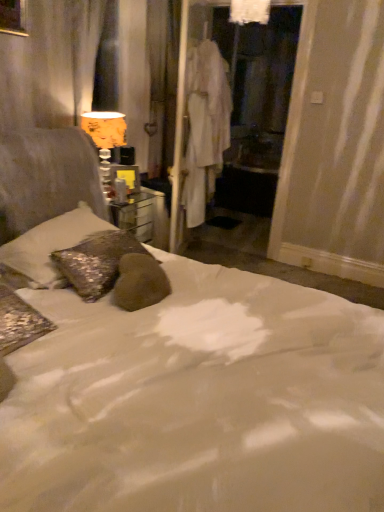
Question: Is orange fabric lampshade at upper left located within white fabric robe at center?

Choices:
 (A) no
 (B) yes

Answer: (A)

Question: From a real-world perspective, is white fabric robe at center located beneath orange fabric lampshade at upper left?

Choices:
 (A) no
 (B) yes

Answer: (A)

Question: Is orange fabric lampshade at upper left at the back of white fabric robe at center?

Choices:
 (A) yes
 (B) no

Answer: (B)

Question: Considering the relative sizes of white fabric robe at center and orange fabric lampshade at upper left in the image provided, is white fabric robe at center thinner than orange fabric lampshade at upper left?

Choices:
 (A) no
 (B) yes

Answer: (A)

Question: From a real-world perspective, is white fabric robe at center physically above orange fabric lampshade at upper left?

Choices:
 (A) no
 (B) yes

Answer: (B)

Question: Looking at their shapes, would you say sparkly silver pillow at left is wider or thinner than white fabric screen door at center?

Choices:
 (A) thin
 (B) wide

Answer: (B)

Question: From the image's perspective, relative to white fabric screen door at center, is sparkly silver pillow at left above or below?

Choices:
 (A) below
 (B) above

Answer: (A)

Question: Considering the positions of sparkly silver pillow at left and white fabric screen door at center in the image, is sparkly silver pillow at left taller or shorter than white fabric screen door at center?

Choices:
 (A) short
 (B) tall

Answer: (A)

Question: Is sparkly silver pillow at left bigger or smaller than white fabric screen door at center?

Choices:
 (A) big
 (B) small

Answer: (B)

Question: Visually, is white fabric screen door at center positioned to the left or to the right of white fabric robe at center?

Choices:
 (A) right
 (B) left

Answer: (A)

Question: Is white fabric screen door at center in front of or behind white fabric robe at center in the image?

Choices:
 (A) front
 (B) behind

Answer: (B)

Question: Is point (206, 3) closer or farther from the camera than point (193, 48)?

Choices:
 (A) farther
 (B) closer

Answer: (B)

Question: From the image's perspective, is white fabric screen door at center located above or below white fabric robe at center?

Choices:
 (A) below
 (B) above

Answer: (B)

Question: Considering the positions of white fabric screen door at center and orange fabric lampshade at upper left in the image, is white fabric screen door at center wider or thinner than orange fabric lampshade at upper left?

Choices:
 (A) wide
 (B) thin

Answer: (B)

Question: Based on their sizes in the image, would you say white fabric screen door at center is bigger or smaller than orange fabric lampshade at upper left?

Choices:
 (A) small
 (B) big

Answer: (B)